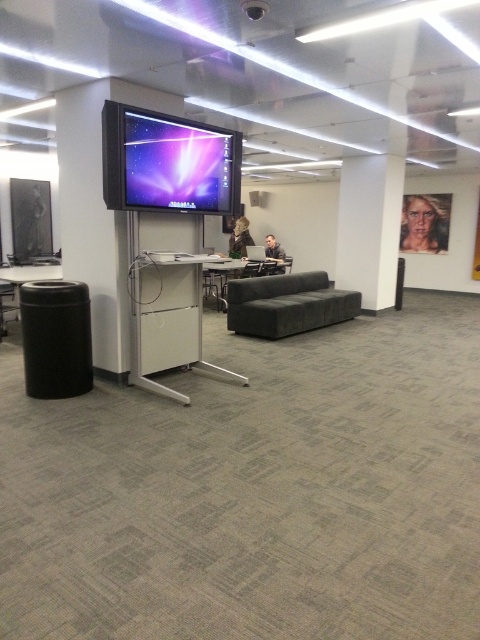
Which of these two, dark gray fabric couch at center or matte gray couch at center, stands shorter?

dark gray fabric couch at center

Who is higher up, dark gray fabric couch at center or matte gray couch at center?

matte gray couch at center is higher up.

Which is behind, point (276, 301) or point (261, 273)?

The point (261, 273) is more distant.

Locate an element on the screen. This screenshot has height=640, width=480. dark gray fabric couch at center is located at coordinates (287, 305).

Is dark gray fabric couch at center above black plastic table at lower left?

No.

Which of these two, dark gray fabric couch at center or black plastic table at lower left, stands shorter?

Standing shorter between the two is black plastic table at lower left.

The width and height of the screenshot is (480, 640). What do you see at coordinates (287, 305) in the screenshot? I see `dark gray fabric couch at center` at bounding box center [287, 305].

Where is `dark gray fabric couch at center`? dark gray fabric couch at center is located at coordinates (287, 305).

Does matte gray couch at center appear on the right side of black plastic table at lower left?

Yes, matte gray couch at center is to the right of black plastic table at lower left.

Who is taller, matte gray couch at center or black plastic table at lower left?

matte gray couch at center

Who is more distant from viewer, (249, 269) or (19, 308)?

Positioned behind is point (249, 269).

Image resolution: width=480 pixels, height=640 pixels. What are the coordinates of `matte gray couch at center` in the screenshot? It's located at (236, 275).